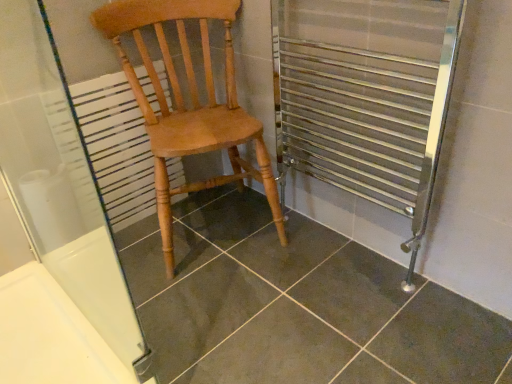
What are the coordinates of `vacant area located to the right-hand side of transparent glass screen door at upper left` in the screenshot? It's located at (229, 319).